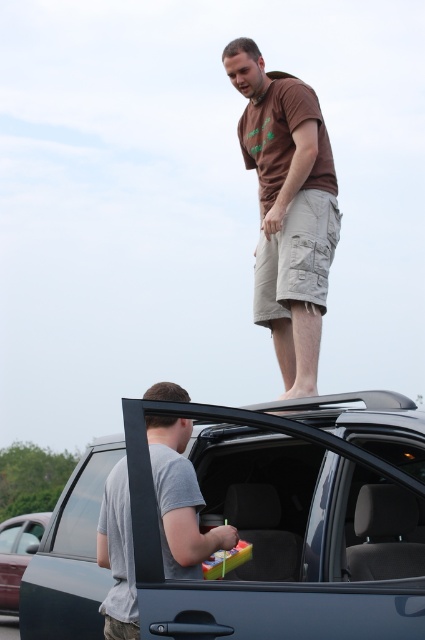
Where is the matte gray suv at center located in the image?

The matte gray suv at center is located at point [254,528] in the image.